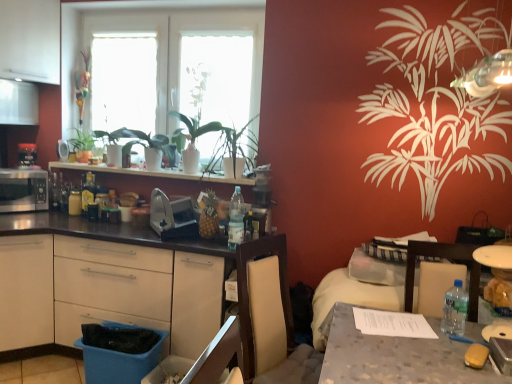
Where is `vacant space situated above transparent glass window screen at upper center, acting as the first window screen starting from the left (from a real-world perspective)`? This screenshot has height=384, width=512. vacant space situated above transparent glass window screen at upper center, acting as the first window screen starting from the left (from a real-world perspective) is located at coordinates (124, 36).